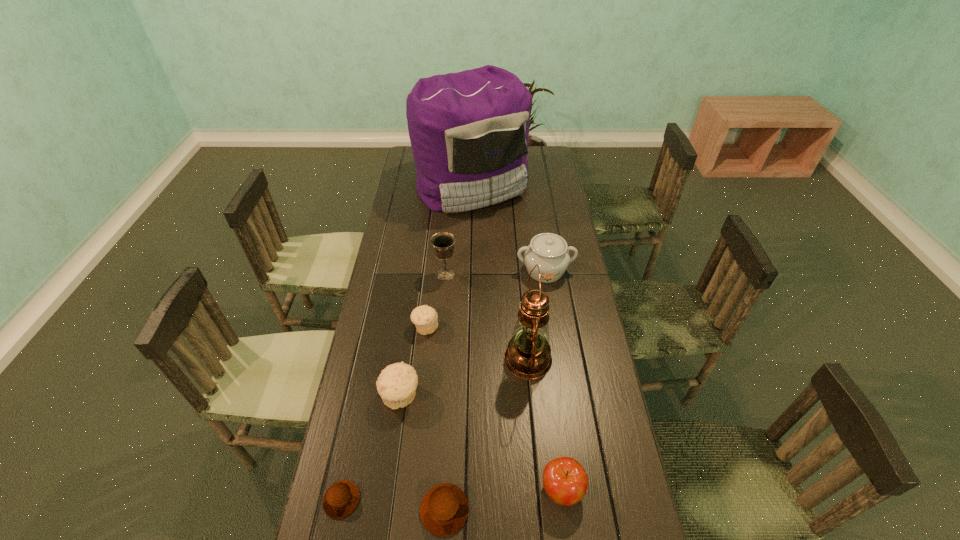
Where is `the fifth closest object to the eighth shortest object`? the fifth closest object to the eighth shortest object is located at coordinates (443, 242).

At what (x,y) coordinates should I click in order to perform the action: click on the sixth closest object to the eighth tallest object. Please return your answer as a coordinate pair (x, y). The width and height of the screenshot is (960, 540). Looking at the image, I should click on (549, 251).

At what (x,y) coordinates should I click in order to perform the action: click on the fourth closest muffin to the white chinaware. Please return your answer as a coordinate pair (x, y). The width and height of the screenshot is (960, 540). Looking at the image, I should click on (341, 498).

You are a GUI agent. You are given a task and a screenshot of the screen. Output one action in this format:
    pyautogui.click(x=<x>, y=<y>)
    Task: Click on the muffin that is the third closest to the chalice
    
    Given the screenshot: What is the action you would take?
    pyautogui.click(x=444, y=509)

Locate an element on the screen. Image resolution: width=960 pixels, height=540 pixels. free point that satisfies the following two spatial constraints: 1. on the back side of the apple; 2. on the left side of the right brown muffin is located at coordinates (445, 490).

This screenshot has width=960, height=540. Identify the location of free region that satisfies the following two spatial constraints: 1. on the back side of the third shortest object; 2. on the right side of the nearer beige muffin. (410, 327).